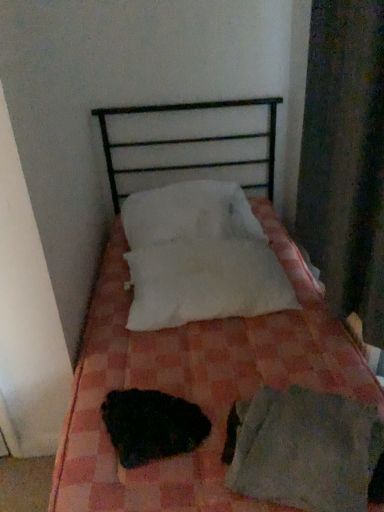
Question: Is white fluffy pillow at center, acting as the second pillow starting from the top, to the left or to the right of white soft pillow at center, the 2th pillow from the bottom, in the image?

Choices:
 (A) left
 (B) right

Answer: (B)

Question: Considering their positions, is white fluffy pillow at center, acting as the second pillow starting from the top, located in front of or behind white soft pillow at center, the 2th pillow from the bottom?

Choices:
 (A) front
 (B) behind

Answer: (A)

Question: Which object is the farthest from the pink checkered bed at center?

Choices:
 (A) white soft pillow at center, the 2th pillow from the bottom
 (B) white fluffy pillow at center, which ranks as the 1th pillow in bottom-to-top order
 (C) light gray cotton sheet at lower right
 (D) black fuzzy animal at center

Answer: (A)

Question: Which of these objects is positioned farthest from the black fuzzy animal at center?

Choices:
 (A) pink checkered bed at center
 (B) light gray cotton sheet at lower right
 (C) white soft pillow at center, which ranks as the 1th pillow in top-to-bottom order
 (D) white fluffy pillow at center, acting as the second pillow starting from the top

Answer: (C)